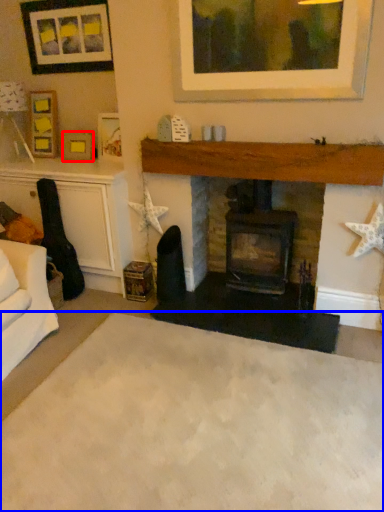
Question: Which point is closer to the camera, picture frame (highlighted by a red box) or plain (highlighted by a blue box)?

Choices:
 (A) picture frame
 (B) plain

Answer: (B)